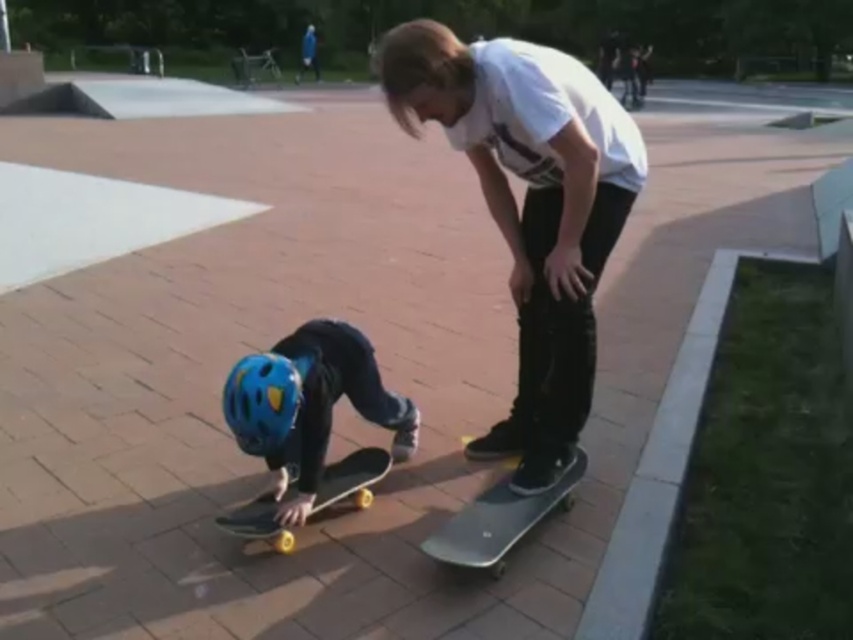
Question: Does matte black skateboard at center have a greater width compared to yellow rubber skateboard at lower center?

Choices:
 (A) yes
 (B) no

Answer: (A)

Question: Which point is closer to the camera?

Choices:
 (A) (569, 497)
 (B) (529, 348)
 (C) (265, 509)

Answer: (C)

Question: Does yellow matte skateboard at lower left lie in front of yellow rubber skateboard at lower center?

Choices:
 (A) yes
 (B) no

Answer: (A)

Question: Is matte black skateboard at center positioned before blue matte helmet at lower center?

Choices:
 (A) yes
 (B) no

Answer: (B)

Question: Considering the real-world distances, which object is closest to the smooth gray skateboard at center?

Choices:
 (A) blue matte helmet at lower center
 (B) yellow rubber skateboard at lower center
 (C) yellow matte skateboard at lower left

Answer: (B)

Question: Which of these objects is positioned closest to the matte black skateboard at center?

Choices:
 (A) yellow rubber skateboard at lower center
 (B) yellow matte skateboard at lower left
 (C) smooth gray skateboard at center
 (D) blue matte helmet at lower center

Answer: (C)